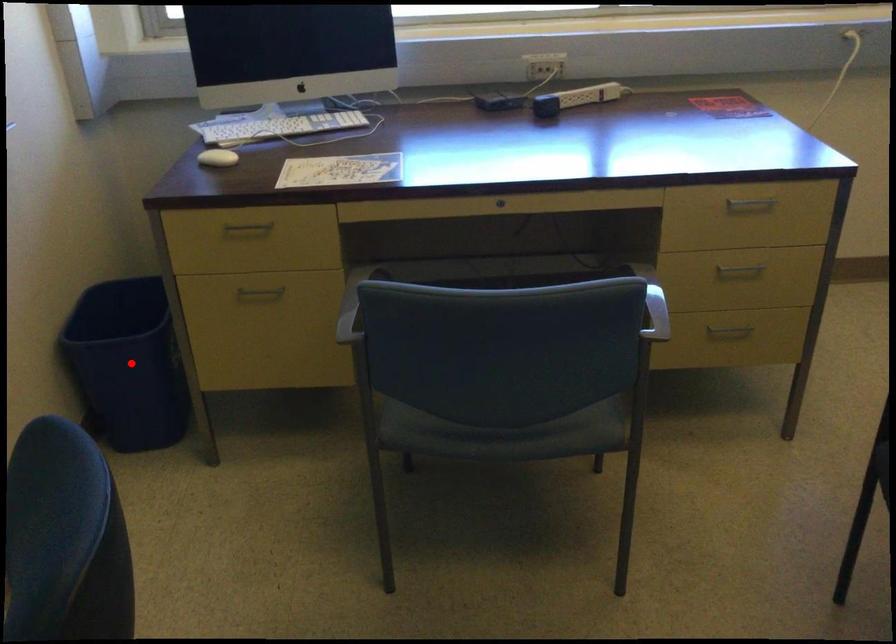
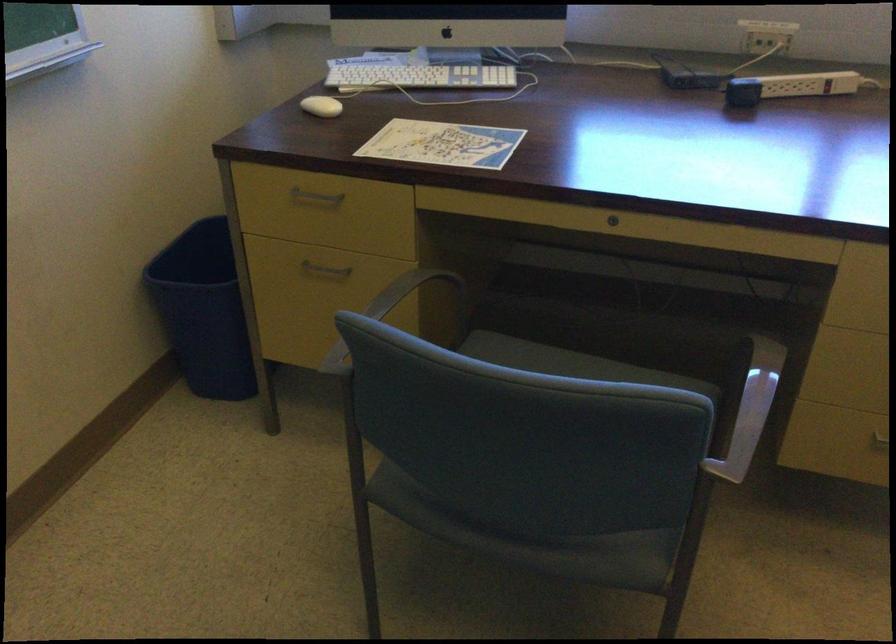
In the second image, find the point that corresponds to the highlighted location in the first image.

(202, 310)